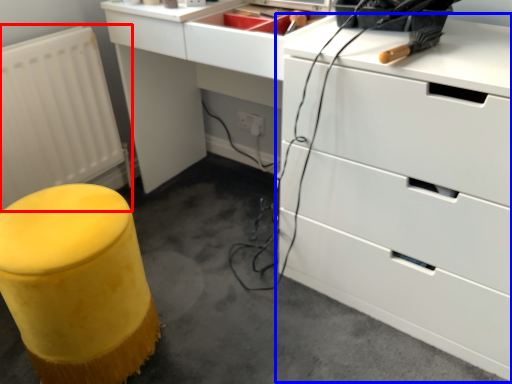
Question: Which object is further to the camera taking this photo, radiator (highlighted by a red box) or chest of drawers (highlighted by a blue box)?

Choices:
 (A) radiator
 (B) chest of drawers

Answer: (A)